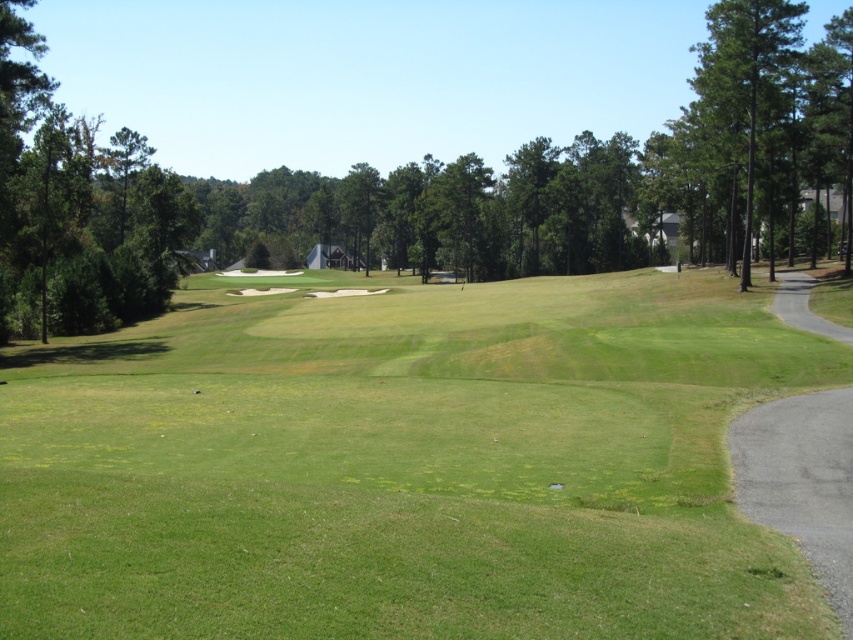
Is green grassy field at center positioned behind green leafy tree at left?

No, it is in front of green leafy tree at left.

How much distance is there between green grassy field at center and green leafy tree at left?

green grassy field at center is 31.65 meters from green leafy tree at left.

Identify the location of green grassy field at center. (404, 465).

Is green grassy field at center bigger than green leafy tree at center?

Actually, green grassy field at center might be smaller than green leafy tree at center.

Does green grassy field at center have a greater height compared to green leafy tree at center?

In fact, green grassy field at center may be shorter than green leafy tree at center.

Does point (532, 518) lie in front of point (438, 202)?

Yes, point (532, 518) is closer to viewer.

Find the location of a particular element. Image resolution: width=853 pixels, height=640 pixels. green grassy field at center is located at coordinates click(x=404, y=465).

Is point (473, 259) positioned behind point (50, 234)?

Yes, point (473, 259) is behind point (50, 234).

Locate an element on the screen. The image size is (853, 640). green leafy tree at center is located at coordinates (430, 186).

This screenshot has width=853, height=640. Find the location of `green leafy tree at center`. green leafy tree at center is located at coordinates (430, 186).